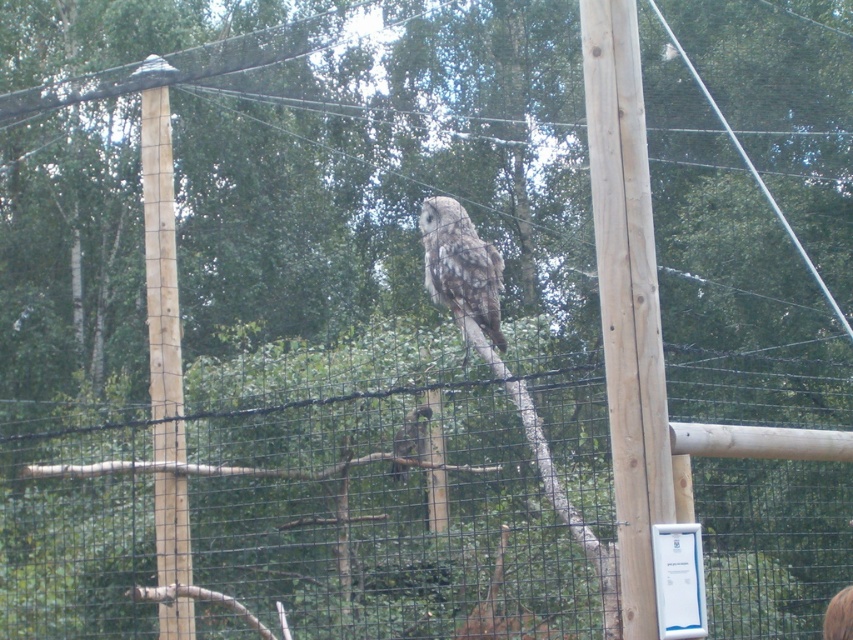
You are a zookeeper trying to determine if the speckled gray owl at center can fly over the black mesh fence at center. Based on their heights, can the owl clear the fence when flying?

The black mesh fence at center is taller than the speckled gray owl at center, so the owl cannot clear the fence when flying.

You are a photographer standing in front of the zoo enclosure. You want to take a closeup photo of the owl on the branch without getting too close to the fence. The camera you have can focus on subjects within 5 meters. Is the natural wood telegraph pole at center within your camera focus range?

The natural wood telegraph pole at center is 4.90 meters away from the camera, which is within the 5 meters focus range. Therefore, the camera can focus on the natural wood telegraph pole at center.

You are a zookeeper observing the enclosure. You notice the black mesh fence at center and the speckled gray owl at center. From your position, which object is positioned to the left?

The black mesh fence at center is to the left of the speckled gray owl at center, so the black mesh fence at center is positioned to the left.